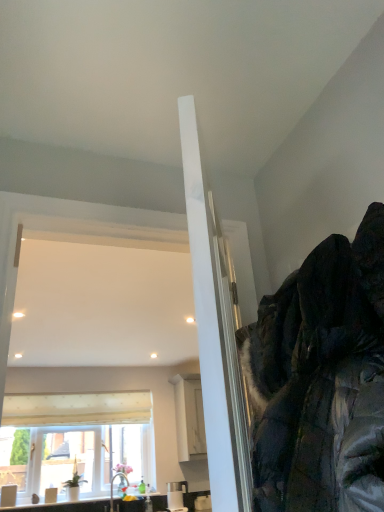
Question: From the image's perspective, is white textured curtain at lower left above or below dark green textured jacket at upper right?

Choices:
 (A) below
 (B) above

Answer: (A)

Question: Is white textured curtain at lower left bigger or smaller than dark green textured jacket at upper right?

Choices:
 (A) small
 (B) big

Answer: (A)

Question: Which of these objects is positioned farthest from the dark green textured jacket at upper right?

Choices:
 (A) white glossy sink at lower left, the second sink positioned from the right
 (B) matte white sink at lower left, acting as the first sink starting from the right
 (C) white textured window at center
 (D) white textured curtain at lower left

Answer: (D)

Question: Which object is the farthest from the matte white sink at lower left, acting as the first sink starting from the right?

Choices:
 (A) white glossy sink at lower left, the second sink positioned from the right
 (B) dark green textured jacket at upper right
 (C) white textured curtain at lower left
 (D) white textured window at center

Answer: (B)